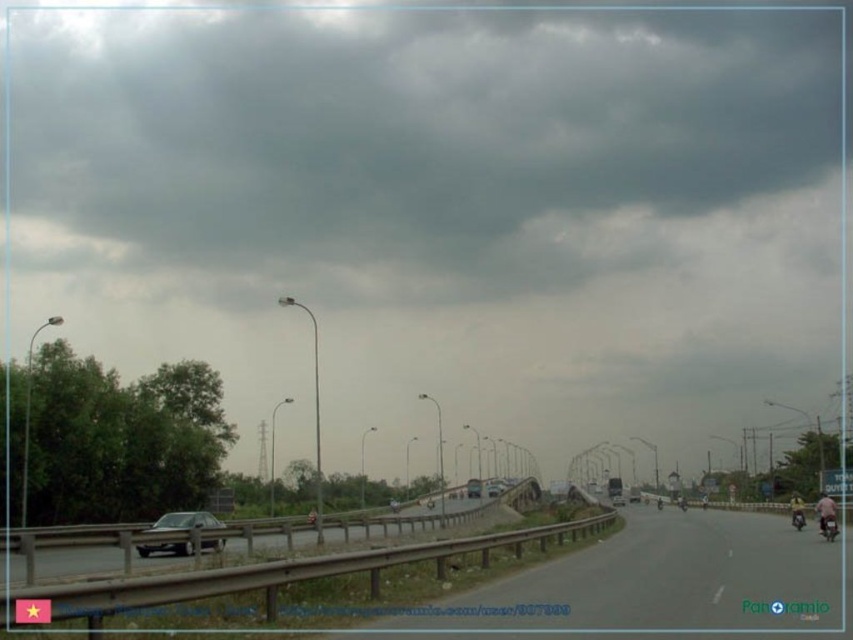
You are a driver approaching the smooth asphalt highway at center and see the metallic silver car at center ahead. Based on their sizes in the image, which one appears larger?

The smooth asphalt highway at center appears larger than the metallic silver car at center because it is much taller as described.

You are a driver approaching the highway and see the shiny silver sedan at lower left. If you want to avoid it, which direction should you steer your car?

Since the shiny silver sedan at lower left is located at coordinates point (184,522), you should steer your car away from that position. However, without knowing your current position, it is difficult to determine the exact direction to avoid it.